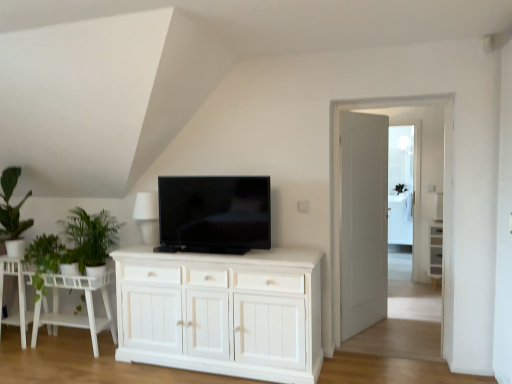
The height and width of the screenshot is (384, 512). I want to click on free location in front of white wooden door at center, so click(x=386, y=340).